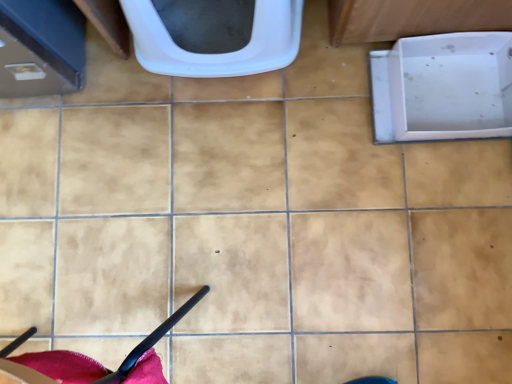
Question: From a real-world perspective, is white plastic toilet at upper center on top of white plastic bath at right?

Choices:
 (A) no
 (B) yes

Answer: (B)

Question: From the image's perspective, is white plastic toilet at upper center above white plastic bath at right?

Choices:
 (A) no
 (B) yes

Answer: (B)

Question: Is white plastic toilet at upper center at the right side of white plastic bath at right?

Choices:
 (A) yes
 (B) no

Answer: (B)

Question: Is white plastic toilet at upper center positioned in front of white plastic bath at right?

Choices:
 (A) yes
 (B) no

Answer: (A)

Question: From a real-world perspective, is white plastic toilet at upper center beneath white plastic bath at right?

Choices:
 (A) yes
 (B) no

Answer: (B)

Question: Does white plastic toilet at upper center appear on the left side of white plastic bath at right?

Choices:
 (A) no
 (B) yes

Answer: (B)

Question: Can you confirm if white plastic bath at right is thinner than white plastic toilet at upper center?

Choices:
 (A) no
 (B) yes

Answer: (A)

Question: Can you confirm if white plastic bath at right is wider than white plastic toilet at upper center?

Choices:
 (A) yes
 (B) no

Answer: (A)

Question: From the image's perspective, is white plastic bath at right beneath white plastic toilet at upper center?

Choices:
 (A) yes
 (B) no

Answer: (A)

Question: Would you say white plastic bath at right is outside white plastic toilet at upper center?

Choices:
 (A) no
 (B) yes

Answer: (B)

Question: Is white plastic bath at right shorter than white plastic toilet at upper center?

Choices:
 (A) yes
 (B) no

Answer: (A)

Question: Is white plastic bath at right taller than white plastic toilet at upper center?

Choices:
 (A) no
 (B) yes

Answer: (A)

Question: Is white plastic toilet at upper center in front of or behind white plastic bath at right in the image?

Choices:
 (A) behind
 (B) front

Answer: (B)